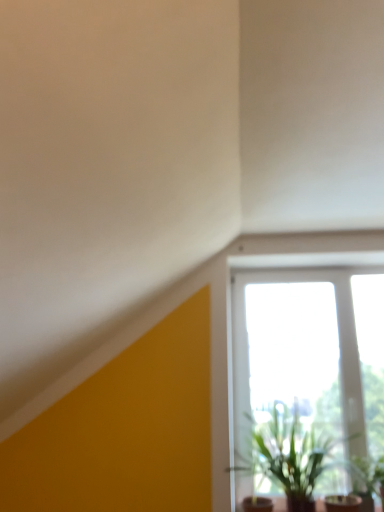
Question: Considering the positions of point (274, 375) and point (364, 495), is point (274, 375) closer or farther from the camera than point (364, 495)?

Choices:
 (A) closer
 (B) farther

Answer: (B)

Question: Is transparent glass window at center in front of or behind green leafy plant at lower right, which is the first houseplant from right to left, in the image?

Choices:
 (A) front
 (B) behind

Answer: (B)

Question: Based on their relative distances, which object is farther from the transparent glass window at center?

Choices:
 (A) green leafy plant at lower right, which is the first houseplant from right to left
 (B) green leafy plant at lower right, marked as the second houseplant in a right-to-left arrangement

Answer: (A)

Question: Which object is positioned closest to the green leafy plant at lower right, which is the first houseplant from right to left?

Choices:
 (A) transparent glass window at center
 (B) green leafy plant at lower right, marked as the second houseplant in a right-to-left arrangement

Answer: (B)